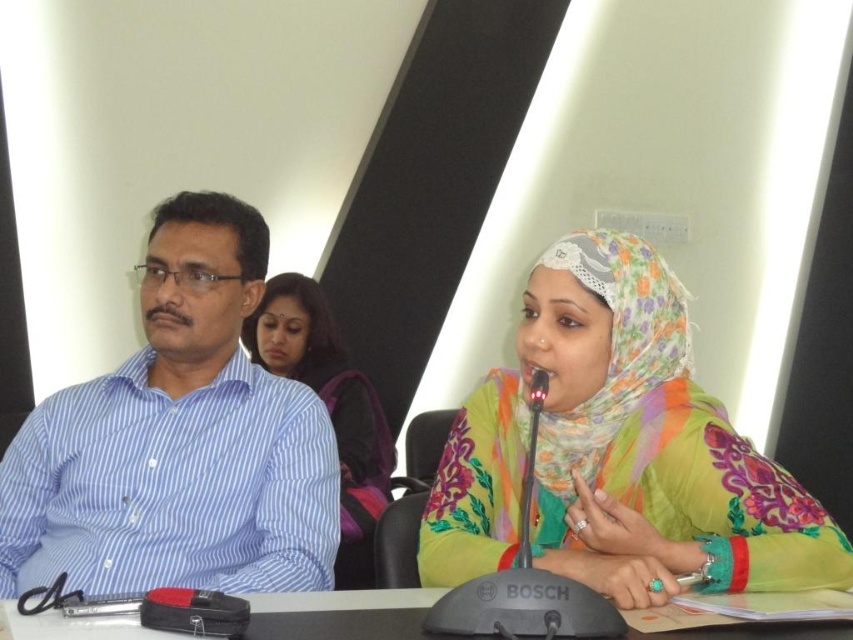
Does floral fabric hijab at center have a greater width compared to black plastic table at lower center?

Yes, floral fabric hijab at center is wider than black plastic table at lower center.

In the scene shown: Can you confirm if floral fabric hijab at center is positioned above black plastic table at lower center?

Yes, floral fabric hijab at center is above black plastic table at lower center.

In order to click on floral fabric hijab at center in this screenshot , I will do pyautogui.click(x=650, y=442).

Does floral fabric hijab at center appear on the right side of blue striped shirt at left?

Correct, you'll find floral fabric hijab at center to the right of blue striped shirt at left.

Between floral fabric hijab at center and blue striped shirt at left, which one has more height?

blue striped shirt at left

Based on the photo, who is more distant from viewer, (653, 552) or (131, 573)?

Positioned behind is point (131, 573).

Find the location of `floral fabric hijab at center`. floral fabric hijab at center is located at coordinates (650, 442).

Who is positioned more to the right, floral fabric hijab at center or matte purple backpack at center?

floral fabric hijab at center

Which is above, floral fabric hijab at center or matte purple backpack at center?

Positioned higher is floral fabric hijab at center.

Find the location of a particular element. floral fabric hijab at center is located at coordinates (650, 442).